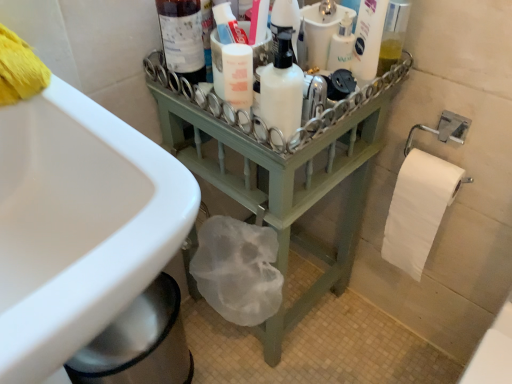
Question: Can you confirm if green painted wood at center is taller than matte glass bottle at upper center?

Choices:
 (A) no
 (B) yes

Answer: (B)

Question: Considering the relative positions of green painted wood at center and matte glass bottle at upper center in the image provided, is green painted wood at center to the left of matte glass bottle at upper center from the viewer's perspective?

Choices:
 (A) no
 (B) yes

Answer: (A)

Question: Is green painted wood at center closer to the viewer compared to matte glass bottle at upper center?

Choices:
 (A) no
 (B) yes

Answer: (B)

Question: Is green painted wood at center bigger than matte glass bottle at upper center?

Choices:
 (A) no
 (B) yes

Answer: (B)

Question: From a real-world perspective, is green painted wood at center on matte glass bottle at upper center?

Choices:
 (A) no
 (B) yes

Answer: (A)

Question: Considering the positions of point (378, 31) and point (345, 16), is point (378, 31) closer or farther from the camera than point (345, 16)?

Choices:
 (A) closer
 (B) farther

Answer: (A)

Question: From a real-world perspective, relative to white glossy mouthwash at center, is white glossy lotion at upper right, the 3th cleaning product in the left-to-right sequence, vertically above or below?

Choices:
 (A) above
 (B) below

Answer: (A)

Question: Is white glossy lotion at upper right, which is the 1th cleaning product in right-to-left order, to the left or to the right of white glossy mouthwash at center in the image?

Choices:
 (A) right
 (B) left

Answer: (A)

Question: Based on their sizes in the image, would you say white glossy lotion at upper right, the 3th cleaning product in the left-to-right sequence, is bigger or smaller than white glossy mouthwash at center?

Choices:
 (A) small
 (B) big

Answer: (B)

Question: In terms of width, does white glossy sink at lower left look wider or thinner when compared to white glossy lotion at upper right, the 3th cleaning product in the left-to-right sequence?

Choices:
 (A) thin
 (B) wide

Answer: (B)

Question: Is white glossy sink at lower left bigger or smaller than white glossy lotion at upper right, which is the 1th cleaning product in right-to-left order?

Choices:
 (A) big
 (B) small

Answer: (A)

Question: In terms of height, does white glossy sink at lower left look taller or shorter compared to white glossy lotion at upper right, which is the 1th cleaning product in right-to-left order?

Choices:
 (A) short
 (B) tall

Answer: (B)

Question: Relative to white glossy lotion at upper right, which is the 1th cleaning product in right-to-left order, is white glossy sink at lower left in front or behind?

Choices:
 (A) behind
 (B) front

Answer: (B)

Question: Considering the positions of white glossy mouthwash at center and translucent plastic bottle at upper center, acting as the 2th cleaning product starting from the right, in the image, is white glossy mouthwash at center bigger or smaller than translucent plastic bottle at upper center, acting as the 2th cleaning product starting from the right,?

Choices:
 (A) small
 (B) big

Answer: (A)

Question: Visually, is white glossy mouthwash at center positioned to the left or to the right of translucent plastic bottle at upper center, marked as the 2th cleaning product in a left-to-right arrangement?

Choices:
 (A) right
 (B) left

Answer: (A)